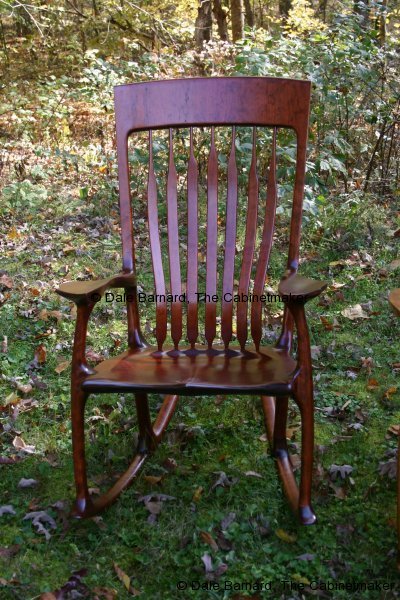
This screenshot has height=600, width=400. I want to click on the headrest of rocking chair, so click(x=207, y=98).